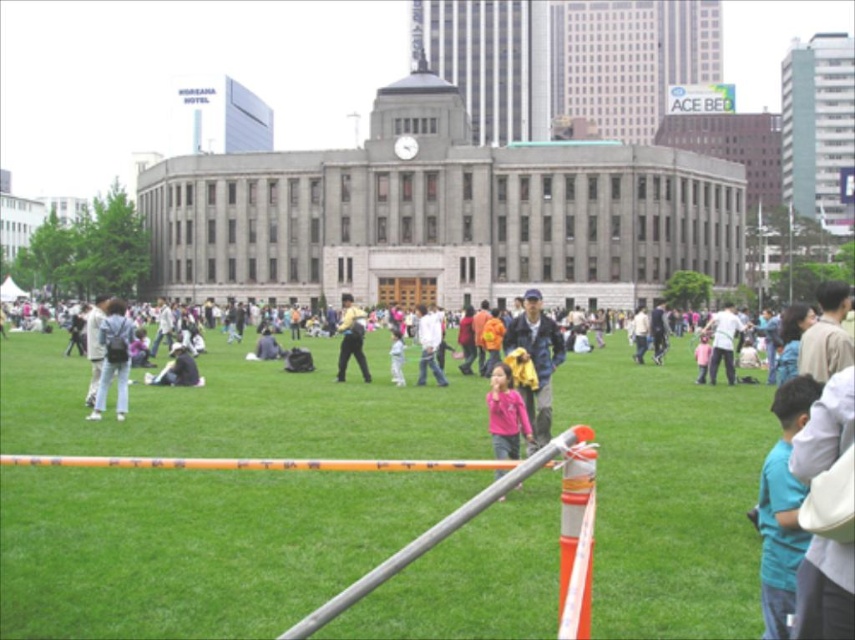
Looking at this image, is blue denim jacket at center to the left of dark blue shirt at center from the viewer's perspective?

Incorrect, blue denim jacket at center is not on the left side of dark blue shirt at center.

Who is positioned more to the left, blue denim jacket at center or dark blue shirt at center?

From the viewer's perspective, dark blue shirt at center appears more on the left side.

At what (x,y) coordinates should I click in order to perform the action: click on blue denim jacket at center. Please return your answer as a coordinate pair (x, y). Image resolution: width=855 pixels, height=640 pixels. Looking at the image, I should click on (535, 360).

Can you confirm if orange plastic rail at center is taller than dark blue shirt at center?

Yes.

Is orange plastic rail at center below dark blue shirt at center?

Yes.

Between point (351, 593) and point (254, 353), which one is positioned behind?

Point (254, 353)

This screenshot has height=640, width=855. I want to click on orange plastic rail at center, so click(435, 532).

Consider the image. Which is above, blue cotton shirt at right or yellow fabric backpack at center?

Positioned higher is yellow fabric backpack at center.

Can you confirm if blue cotton shirt at right is thinner than yellow fabric backpack at center?

Incorrect, blue cotton shirt at right's width is not less than yellow fabric backpack at center's.

Locate an element on the screen. blue cotton shirt at right is located at coordinates (782, 508).